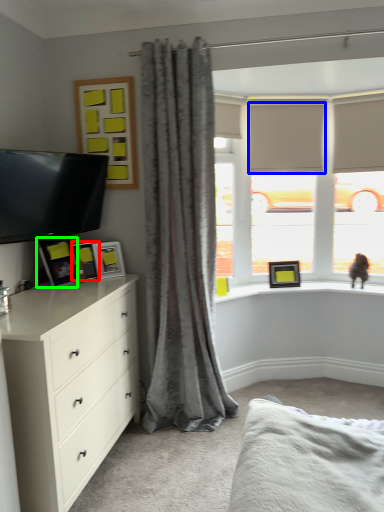
Question: Estimate the real-world distances between objects in this image. Which object is farther from picture frame (highlighted by a red box), blind (highlighted by a blue box) or picture frame (highlighted by a green box)?

Choices:
 (A) blind
 (B) picture frame

Answer: (A)